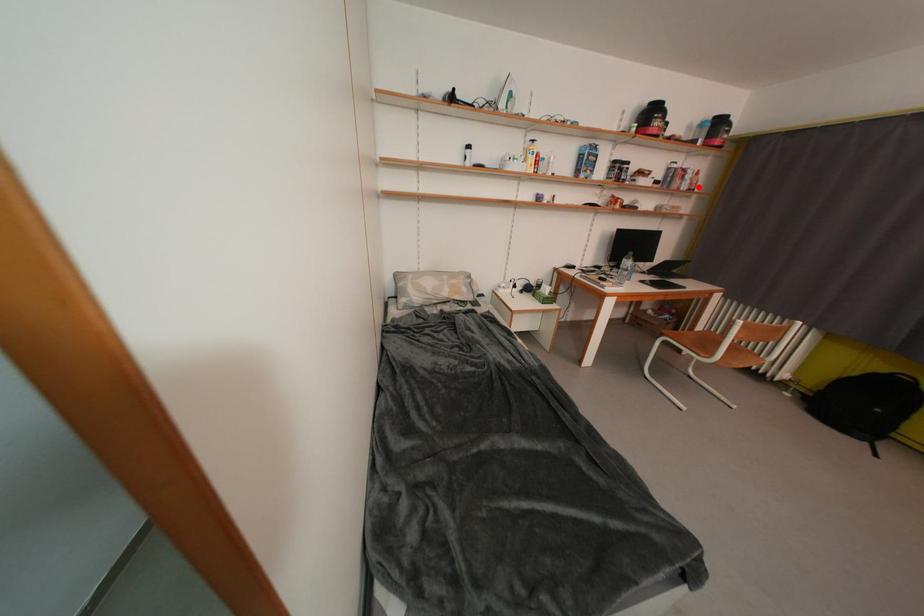
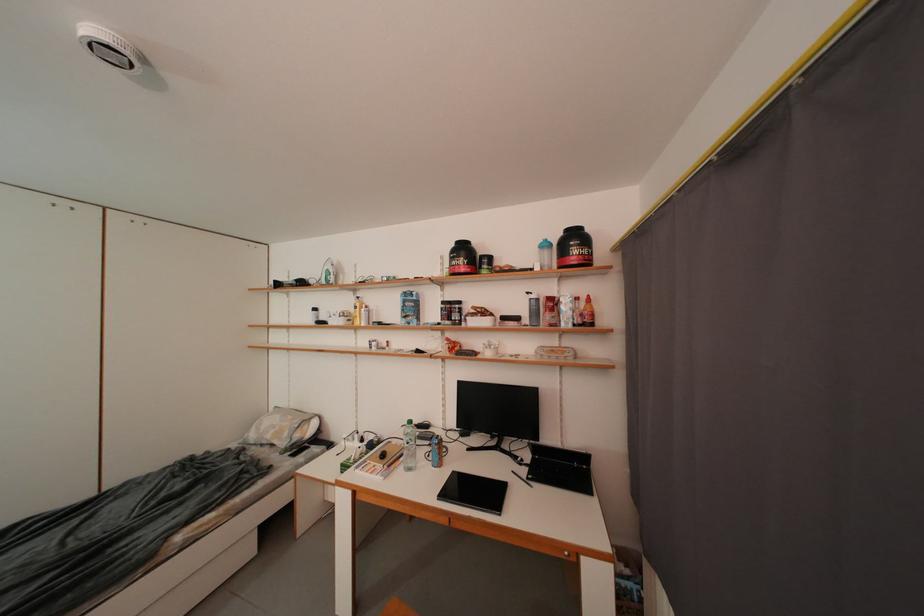
In the second image, find the point that corresponds to the highlighted location in the first image.

(590, 318)